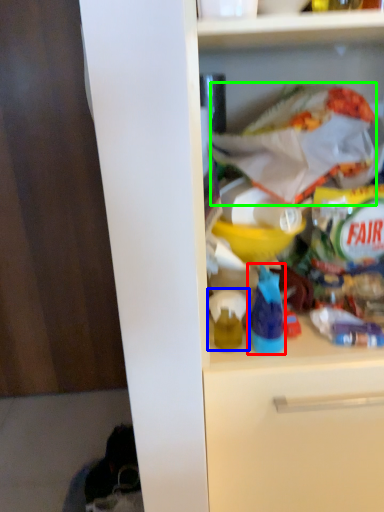
Question: Considering the real-world distances, which object is closest to bottle (highlighted by a red box)? toy (highlighted by a blue box) or material (highlighted by a green box).

Choices:
 (A) toy
 (B) material

Answer: (A)